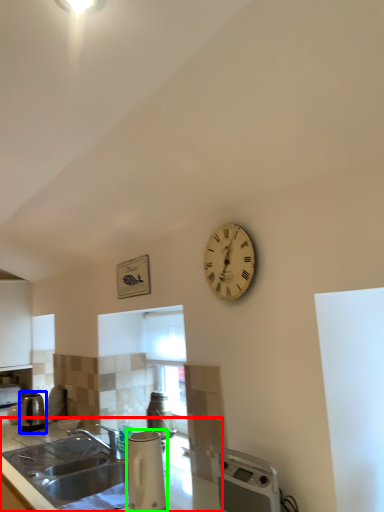
Question: Based on their relative distances, which object is farther from countertop (highlighted by a red box)? Choose from kitchen appliance (highlighted by a blue box) and appliance (highlighted by a green box).

Choices:
 (A) kitchen appliance
 (B) appliance

Answer: (B)